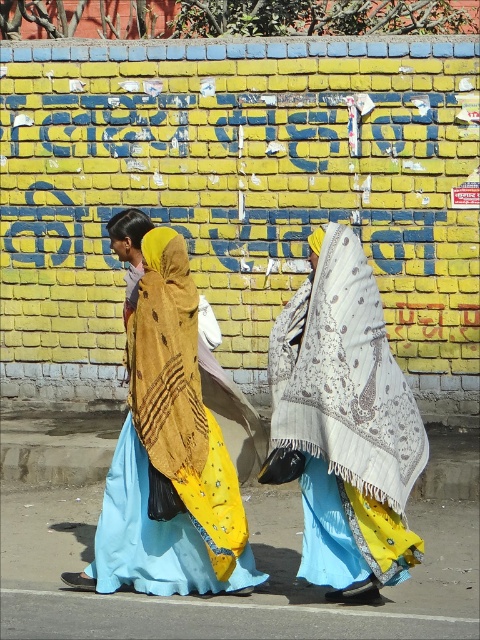
Between yellow fabric shawl at center and brown textured shawl at center, which one has less height?

brown textured shawl at center

You are a GUI agent. You are given a task and a screenshot of the screen. Output one action in this format:
    pyautogui.click(x=<x>, y=<y>)
    Task: Click on the yellow fabric shawl at center
    This screenshot has height=640, width=480.
    Given the screenshot: What is the action you would take?
    pyautogui.click(x=168, y=456)

Where is `yellow fabric shawl at center`? yellow fabric shawl at center is located at coordinates (168, 456).

Between white textured shawl at center and brown textured shawl at center, which one appears on the right side from the viewer's perspective?

white textured shawl at center is more to the right.

Does white textured shawl at center have a greater height compared to brown textured shawl at center?

Yes, white textured shawl at center is taller than brown textured shawl at center.

Where is `white textured shawl at center`? white textured shawl at center is located at coordinates (346, 422).

The image size is (480, 640). Find the location of `white textured shawl at center`. white textured shawl at center is located at coordinates (346, 422).

From the picture: Is white textured shawl at center smaller than yellow fabric shawl at center?

Indeed, white textured shawl at center has a smaller size compared to yellow fabric shawl at center.

Is point (307, 529) positioned in front of point (165, 406)?

No, (307, 529) is further to viewer.

Where is `white textured shawl at center`? white textured shawl at center is located at coordinates (346, 422).